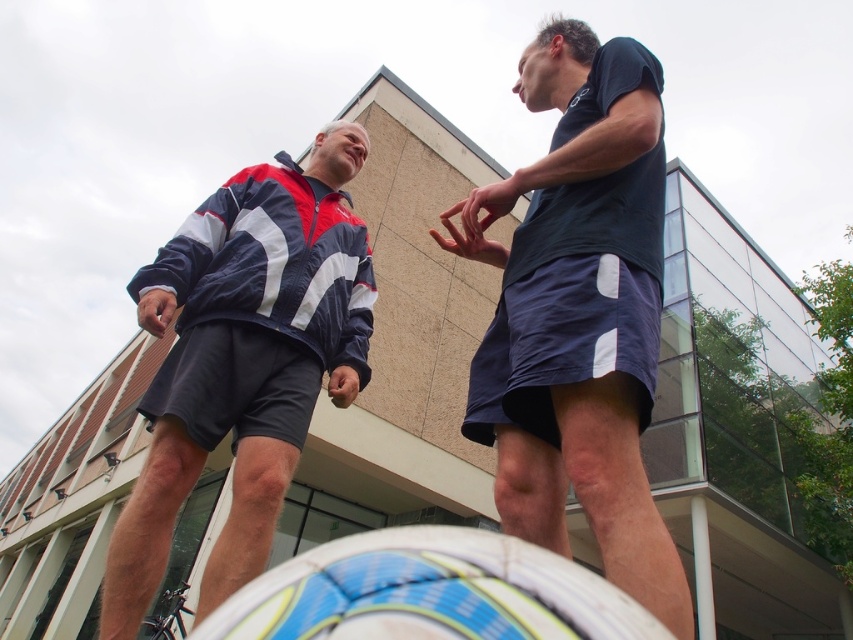
Question: Considering the relative positions of dark blue shorts at center and blue and white striped jacket at upper left in the image provided, where is dark blue shorts at center located with respect to blue and white striped jacket at upper left?

Choices:
 (A) below
 (B) above

Answer: (B)

Question: Does dark blue shorts at center come behind blue textured soccer ball at lower center?

Choices:
 (A) yes
 (B) no

Answer: (A)

Question: Which object is closer to the camera taking this photo?

Choices:
 (A) blue textured soccer ball at lower center
 (B) blue and white striped jacket at upper left
 (C) dark blue shorts at center

Answer: (A)

Question: Which of the following is the farthest from the observer?

Choices:
 (A) (264, 275)
 (B) (595, 218)

Answer: (A)

Question: Among these points, which one is farthest from the camera?

Choices:
 (A) (222, 248)
 (B) (593, 481)
 (C) (318, 566)

Answer: (A)

Question: Can you confirm if dark blue shorts at center is wider than blue and white striped jacket at upper left?

Choices:
 (A) yes
 (B) no

Answer: (B)